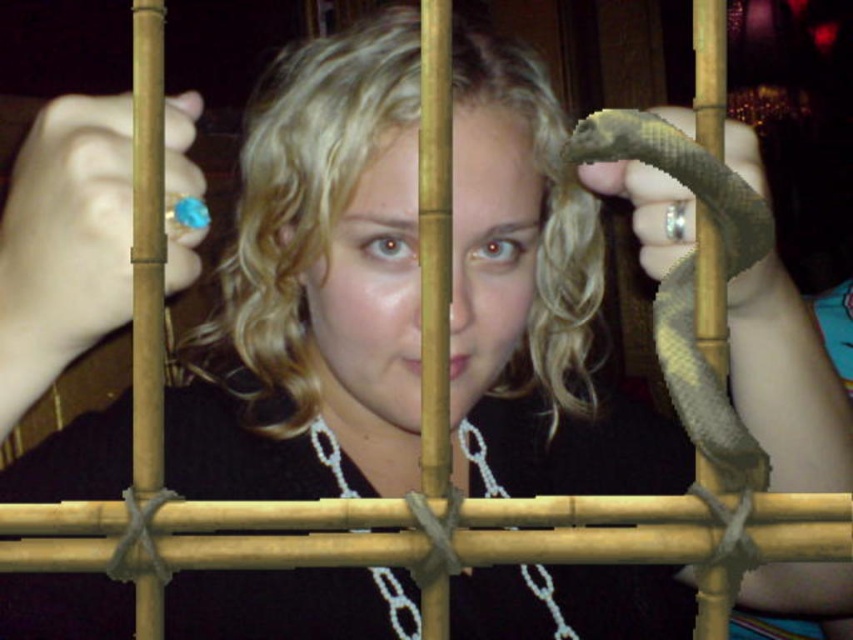
You are a zookeeper tasked with feeding the animals. You see a green matte snake at center and a silver metallic chain at center. Which object is narrower?

The green matte snake at center is narrower than the silver metallic chain at center.

You are a security guard in a zoo and you see the green matte snake at center and the silver metallic chain at center. Which object is nearer to you?

The green matte snake at center is closer to the viewer than the silver metallic chain at center.